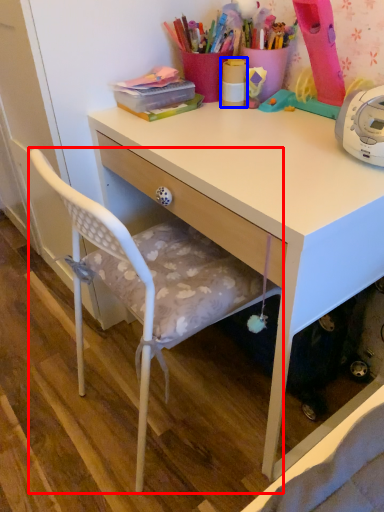
Question: Which point is closer to the camera, chair (highlighted by a red box) or office supplies (highlighted by a blue box)?

Choices:
 (A) chair
 (B) office supplies

Answer: (A)